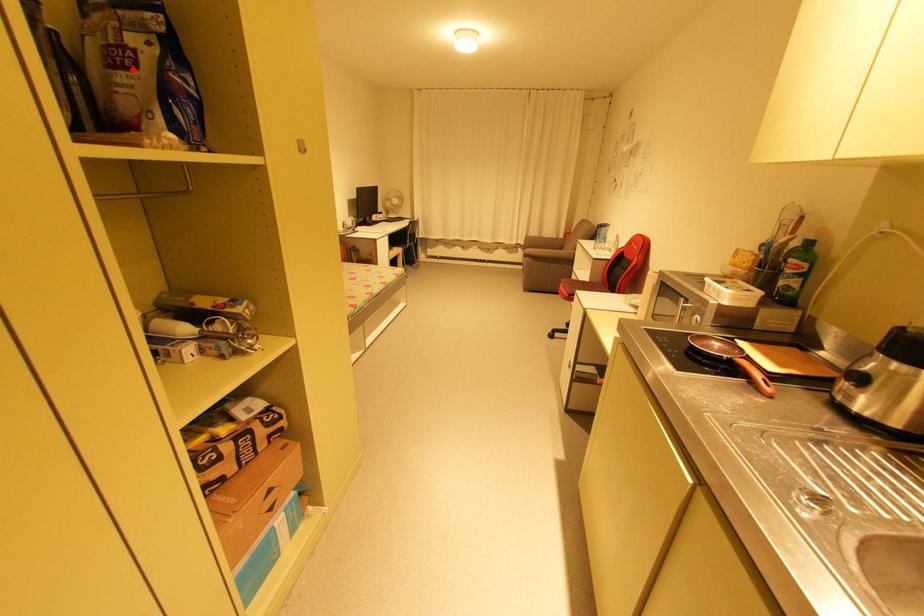
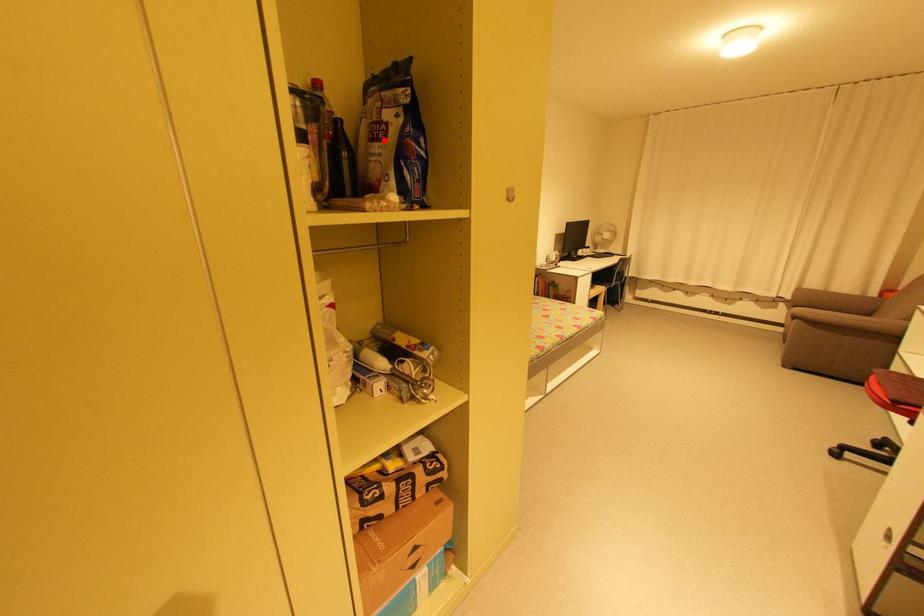
I am providing you with two images of the same scene from different viewpoints. A red point is marked on the first image and another point is marked on the second image. Is the red point in image1 aligned with the point shown in image2?

Yes